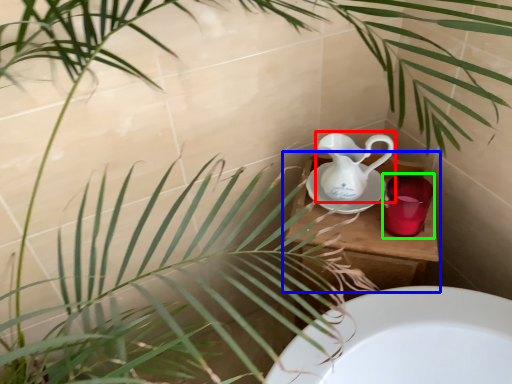
Question: Which is farther away from jug (highlighted by a red box)? table (highlighted by a blue box) or mug (highlighted by a green box)?

Choices:
 (A) table
 (B) mug

Answer: (B)